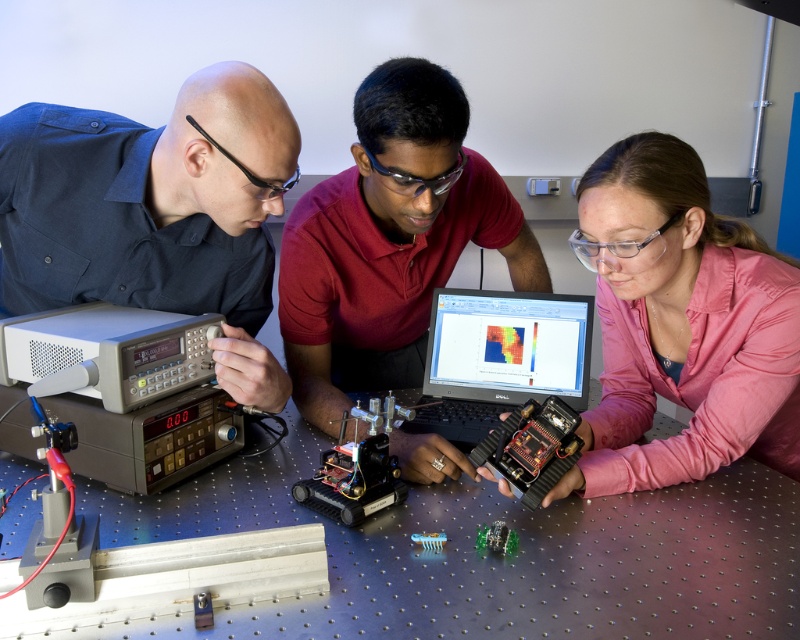
You are standing at the point labeled point (121, 449) and want to take a photo of the robotic device on the workbench. The camera you have can focus on objects within 1.0 meters. Can you take a clear photo of the robotic device without moving from your current position?

The distance between point (121, 449) and the camera is 1.07 meters, which is beyond the camera focus range of 1.0 meters. Therefore, you cannot take a clear photo of the robotic device without moving from your current position.

You are a technician who needs to reach the metallic silver table at center while standing at the position of matte black shirt at left. Is there enough space to move freely between them?

The distance between the metallic silver table at center and the matte black shirt at left is 17.17 inches. Since this distance is relatively narrow, moving freely might be challenging, especially if you need to maneuver around or between them. Consider if the space allows for comfortable movement given your body size and the tasks required.